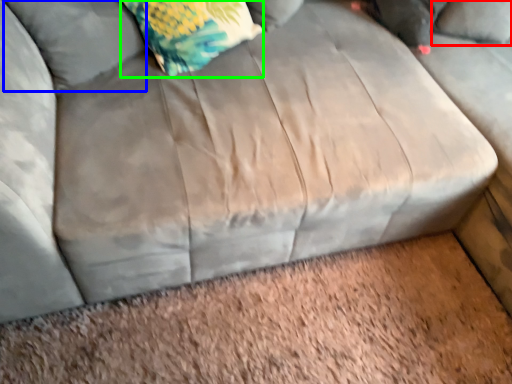
Question: Which object is the closest to the pillow (highlighted by a red box)? Choose among these: pillow (highlighted by a blue box) or throw pillow (highlighted by a green box).

Choices:
 (A) pillow
 (B) throw pillow

Answer: (B)